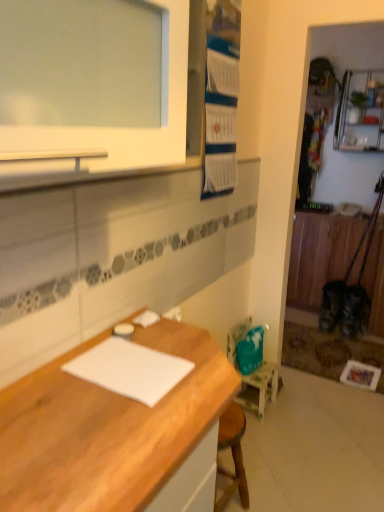
Identify the location of free spot above white paper at center (from a real-world perspective). The image size is (384, 512). (132, 362).